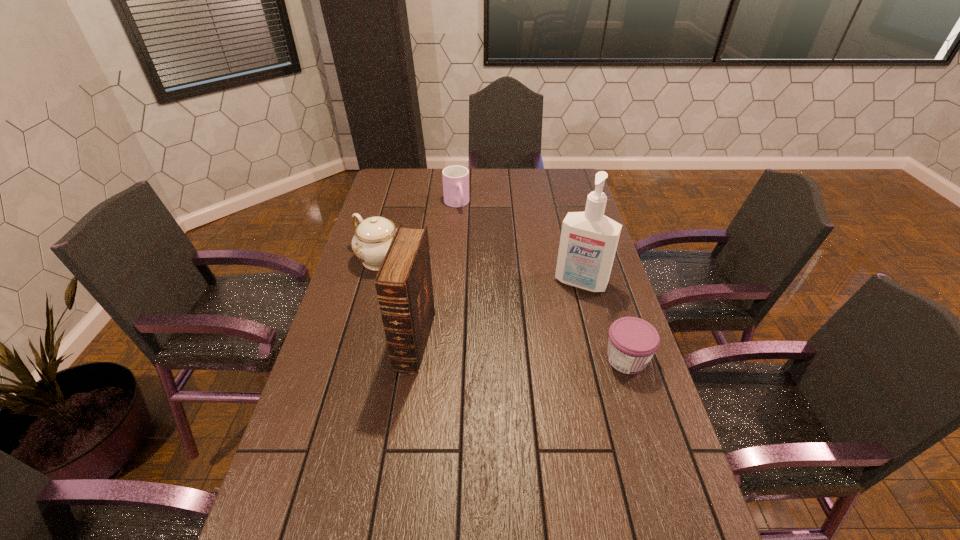
This screenshot has height=540, width=960. I want to click on cleansing agent that is at the right edge, so click(x=588, y=243).

Image resolution: width=960 pixels, height=540 pixels. In the image, there is a desktop. In order to click on vacant space at the far edge in this screenshot , I will do `click(528, 185)`.

Where is `free spot at the near edge of the desktop`? free spot at the near edge of the desktop is located at coordinates (492, 523).

In the image, there is a desktop. Identify the location of free space at the left edge. The image size is (960, 540). (333, 366).

In the image, there is a desktop. At what (x,y) coordinates should I click in order to perform the action: click on free space at the right edge. Please return your answer as a coordinate pair (x, y). Looking at the image, I should click on [644, 476].

Locate an element on the screen. vacant space at the far left corner is located at coordinates (393, 195).

Locate an element on the screen. This screenshot has width=960, height=540. blank space at the near left corner is located at coordinates (336, 524).

You are a GUI agent. You are given a task and a screenshot of the screen. Output one action in this format:
    pyautogui.click(x=<x>, y=<y>)
    Task: Click on the free space at the far right corner of the desktop
    
    Given the screenshot: What is the action you would take?
    pyautogui.click(x=550, y=174)

Locate an element on the screen. The width and height of the screenshot is (960, 540). vacant region between the second shortest object and the shortest object is located at coordinates (541, 282).

This screenshot has width=960, height=540. I want to click on unoccupied position between the cup and the jam, so click(541, 282).